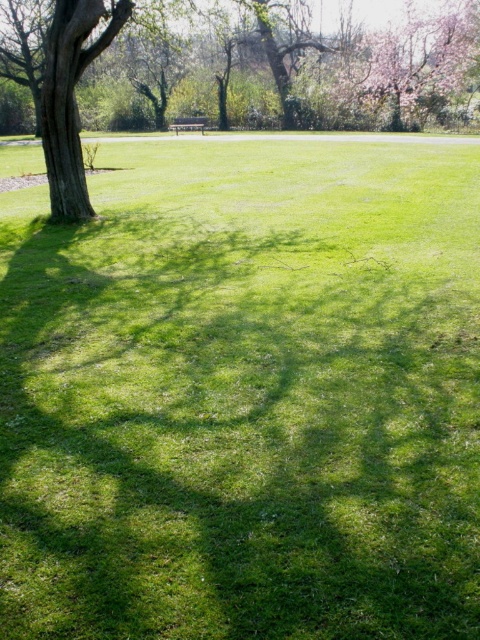
Question: Does green leafy tree at left have a smaller size compared to wooden park bench at center?

Choices:
 (A) yes
 (B) no

Answer: (B)

Question: Does green leafy tree at left appear under wooden park bench at center?

Choices:
 (A) yes
 (B) no

Answer: (A)

Question: Among these points, which one is nearest to the camera?

Choices:
 (A) (173, 122)
 (B) (427, 35)

Answer: (B)

Question: Considering the relative positions of green leafy tree at left and wooden park bench at center in the image provided, where is green leafy tree at left located with respect to wooden park bench at center?

Choices:
 (A) above
 (B) below

Answer: (B)

Question: Which point is closer to the camera?

Choices:
 (A) (124, 12)
 (B) (187, 116)

Answer: (A)